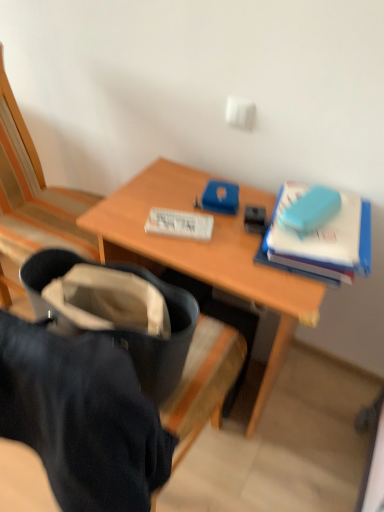
Question: Is wooden chair at left smaller than white paper at center, placed as the first paperback book when sorted from left to right?

Choices:
 (A) yes
 (B) no

Answer: (B)

Question: Is wooden chair at left next to white paper at center, which appears as the second paperback book when viewed from the right, and touching it?

Choices:
 (A) no
 (B) yes

Answer: (A)

Question: Does wooden chair at left have a greater width compared to white paper at center, which appears as the second paperback book when viewed from the right?

Choices:
 (A) yes
 (B) no

Answer: (A)

Question: Could white paper at center, which appears as the second paperback book when viewed from the right, be considered to be inside wooden chair at left?

Choices:
 (A) yes
 (B) no

Answer: (B)

Question: Can you confirm if wooden chair at left is thinner than white paper at center, placed as the first paperback book when sorted from left to right?

Choices:
 (A) yes
 (B) no

Answer: (B)

Question: Is wooden chair at left at the left side of white paper at center, placed as the first paperback book when sorted from left to right?

Choices:
 (A) no
 (B) yes

Answer: (B)

Question: Is there a large distance between white paper at center, placed as the first paperback book when sorted from left to right, and wooden chair at left?

Choices:
 (A) no
 (B) yes

Answer: (A)

Question: Is white paper at center, which appears as the second paperback book when viewed from the right, located outside wooden chair at left?

Choices:
 (A) no
 (B) yes

Answer: (B)

Question: From the image's perspective, is white paper at center, placed as the first paperback book when sorted from left to right, under wooden chair at left?

Choices:
 (A) no
 (B) yes

Answer: (B)

Question: Is white paper at center, which appears as the second paperback book when viewed from the right, beside wooden chair at left?

Choices:
 (A) no
 (B) yes

Answer: (A)

Question: Considering the relative sizes of white paper at center, placed as the first paperback book when sorted from left to right, and wooden chair at left in the image provided, is white paper at center, placed as the first paperback book when sorted from left to right, smaller than wooden chair at left?

Choices:
 (A) no
 (B) yes

Answer: (B)

Question: Does white paper at center, which appears as the second paperback book when viewed from the right, have a larger size compared to wooden chair at left?

Choices:
 (A) no
 (B) yes

Answer: (A)

Question: From a real-world perspective, is blue matte book at upper right, the 1th paperback book in the right-to-left sequence, positioned over wooden chair at left based on gravity?

Choices:
 (A) no
 (B) yes

Answer: (B)